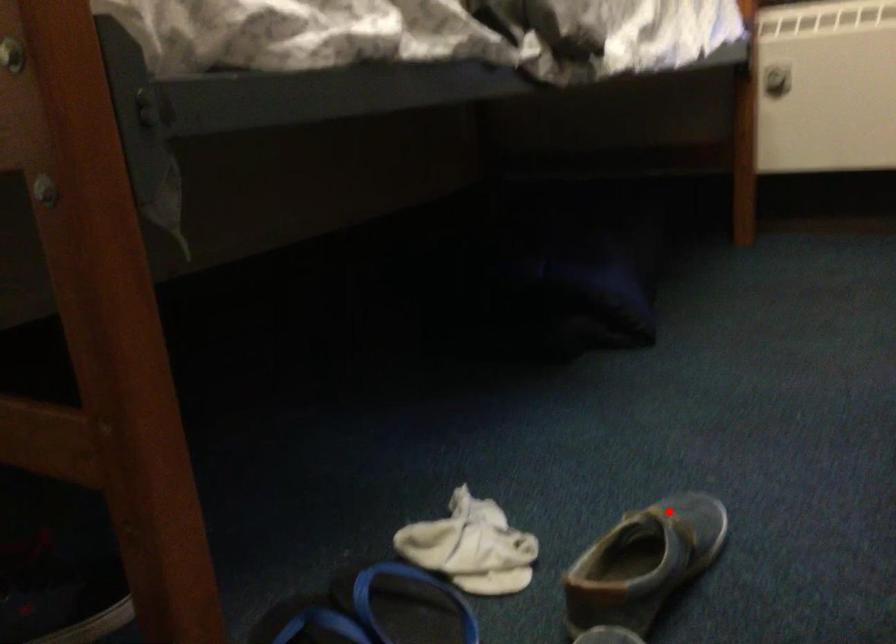
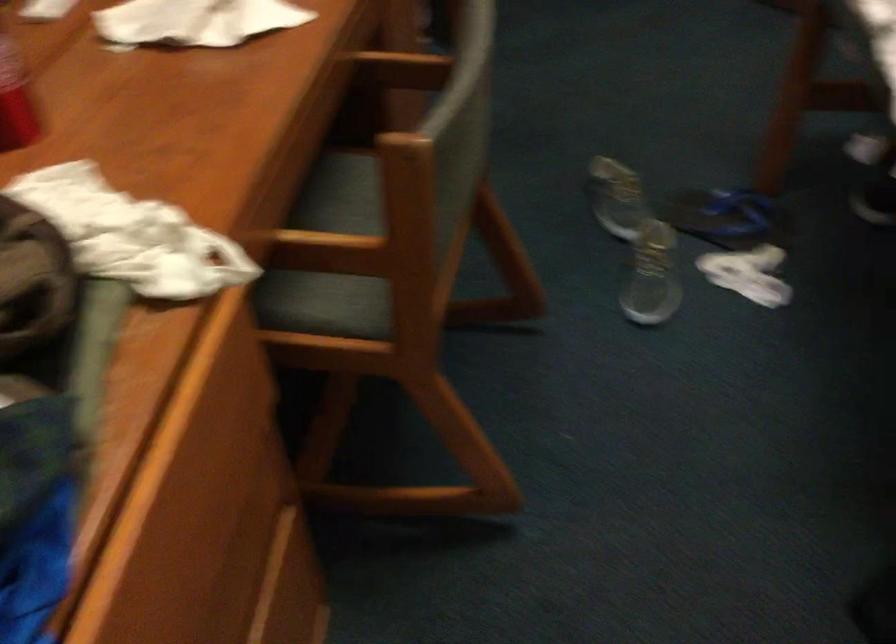
Question: I am providing you with two images of the same scene from different viewpoints. Image1 has a red point marked. In image2, the corresponding 3D location appears at what relative position? Reply with the corresponding letter.

Choices:
 (A) Closer
 (B) Farther

Answer: (B)